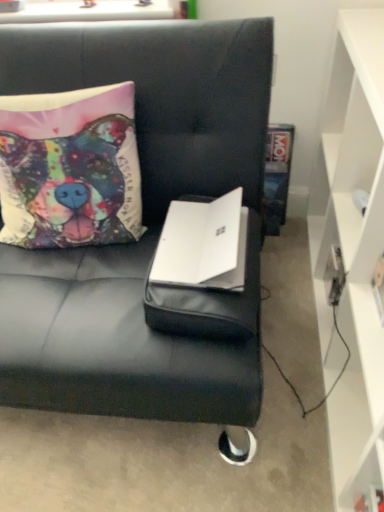
Question: Considering the positions of black leather couch at center and white matte laptop at center in the image, is black leather couch at center wider or thinner than white matte laptop at center?

Choices:
 (A) thin
 (B) wide

Answer: (B)

Question: Is point (124, 75) positioned closer to the camera than point (238, 266)?

Choices:
 (A) closer
 (B) farther

Answer: (B)

Question: Based on their relative distances, which object is farther from the white matte laptop at center?

Choices:
 (A) multicolored fabric pillow at upper left
 (B) white matte cabinet at right
 (C) black leather couch at center

Answer: (B)

Question: Considering the real-world distances, which object is closest to the white matte laptop at center?

Choices:
 (A) white matte cabinet at right
 (B) multicolored fabric pillow at upper left
 (C) black leather couch at center

Answer: (C)